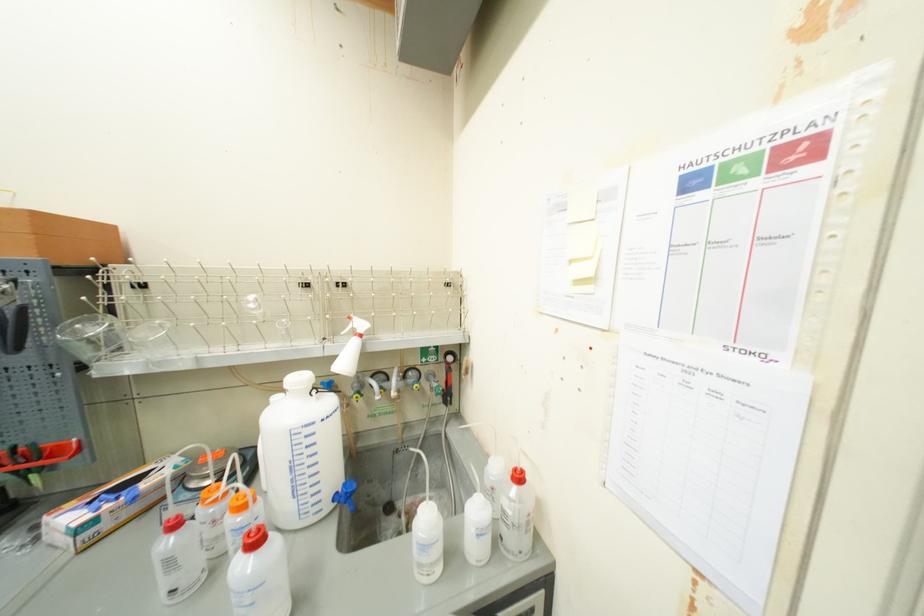
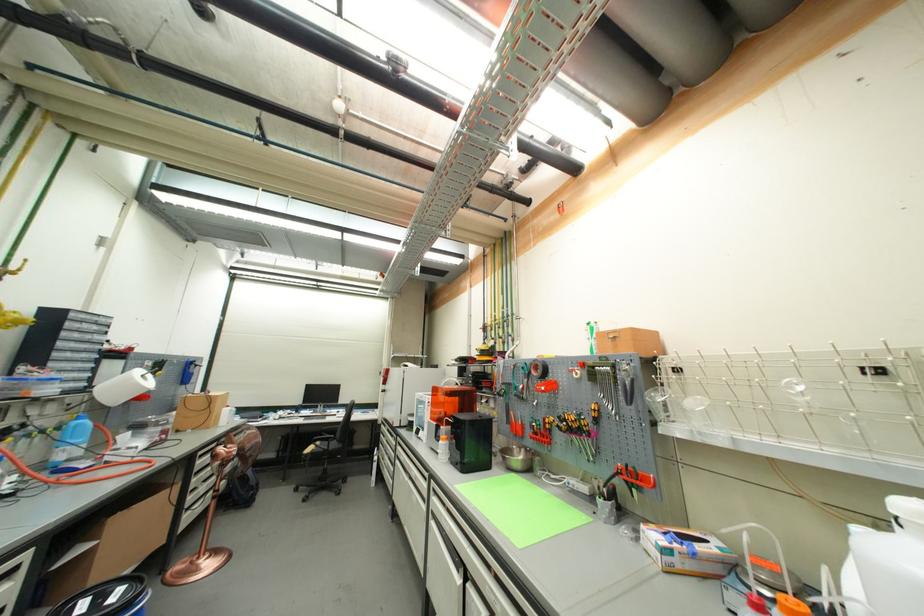
Where in the second image is the point corresponding to point 69,551 from the first image?

(661, 561)